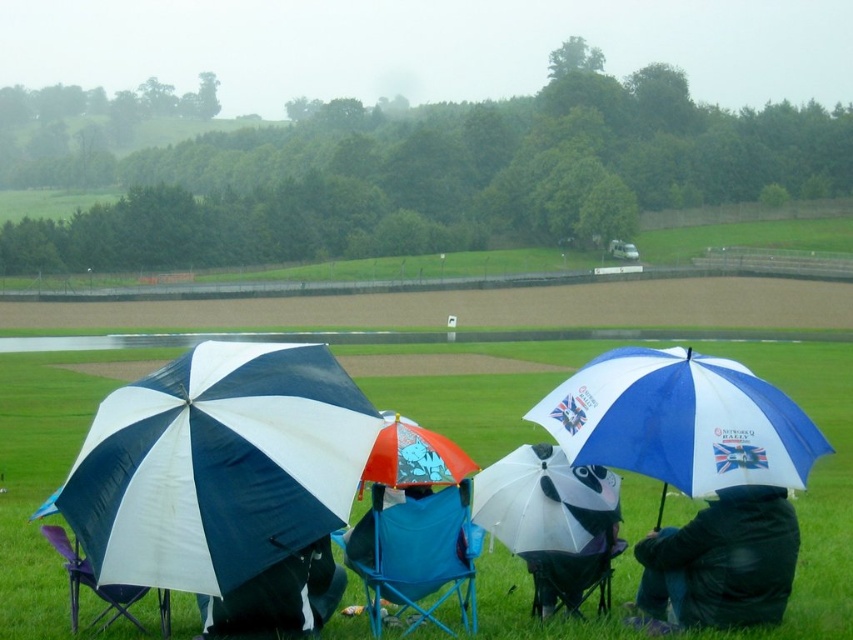
Question: Can you confirm if blue and white fabric umbrella at center right is wider than blue fabric chair at lower center?

Choices:
 (A) yes
 (B) no

Answer: (A)

Question: Is dark blue jacket at lower right smaller than floral-patterned fabric umbrella at center?

Choices:
 (A) no
 (B) yes

Answer: (A)

Question: Estimate the real-world distances between objects in this image. Which object is closer to the green grass at center?

Choices:
 (A) blue fabric chair at lower center
 (B) white matte umbrella at center

Answer: (A)

Question: Estimate the real-world distances between objects in this image. Which object is farther from the green grass at center?

Choices:
 (A) dark blue jacket at lower right
 (B) blue and white fabric umbrella at center right

Answer: (B)

Question: Does blue and white striped umbrella at left have a larger size compared to dark blue jacket at lower right?

Choices:
 (A) no
 (B) yes

Answer: (B)

Question: Which point is farther to the camera?

Choices:
 (A) blue fabric chair at center
 (B) floral-patterned fabric umbrella at center
 (C) blue fabric chair at lower center
 (D) green grass at center

Answer: (C)